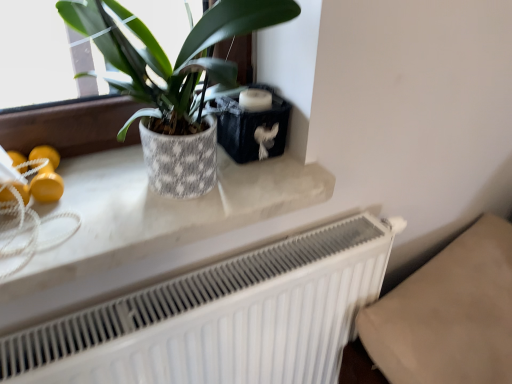
Locate an element on the screen. Image resolution: width=512 pixels, height=384 pixels. blank space situated above white marble counter top at upper center (from a real-world perspective) is located at coordinates (149, 187).